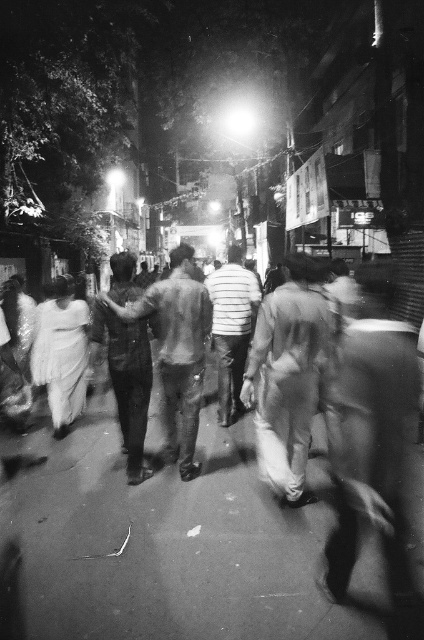
Question: Can you confirm if smooth fabric crowd at center is smaller than smooth fabric shirt at center?

Choices:
 (A) yes
 (B) no

Answer: (A)

Question: Estimate the real-world distances between objects in this image. Which object is farther from the smooth fabric shirt at center?

Choices:
 (A) smooth fabric crowd at center
 (B) smooth fabric shirt at right

Answer: (B)

Question: Is smooth fabric crowd at center wider than smooth fabric shirt at right?

Choices:
 (A) yes
 (B) no

Answer: (A)

Question: Which object appears closest to the camera in this image?

Choices:
 (A) smooth fabric crowd at center
 (B) smooth fabric shirt at right

Answer: (B)

Question: Among these points, which one is nearest to the camera?

Choices:
 (A) (325, 576)
 (B) (86, 509)

Answer: (A)

Question: Observing the image, what is the correct spatial positioning of smooth fabric crowd at center in reference to smooth fabric shirt at center?

Choices:
 (A) above
 (B) below

Answer: (B)